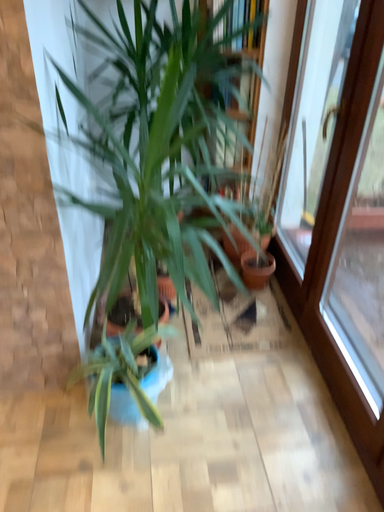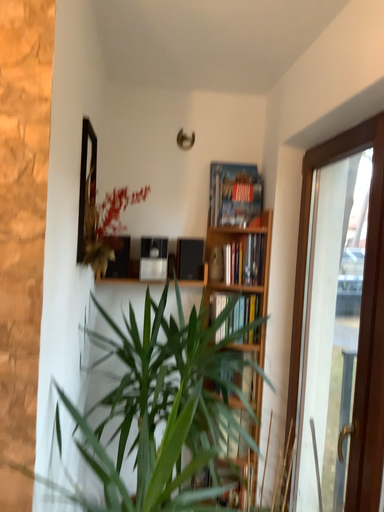
Question: Which way did the camera rotate in the video?

Choices:
 (A) rotated downward
 (B) rotated upward

Answer: (B)